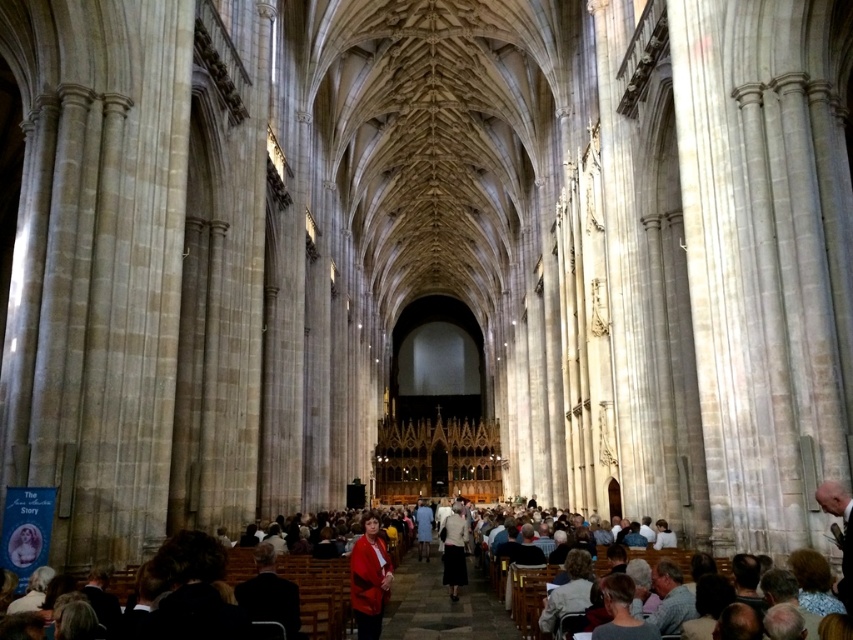
Question: Which of the following is the farthest from the observer?

Choices:
 (A) red fabric coat at center
 (B) matte red coat at center

Answer: (B)

Question: In this image, where is matte red coat at center located relative to light beige skirt at center?

Choices:
 (A) below
 (B) above

Answer: (B)

Question: Does matte red coat at center appear over light beige skirt at center?

Choices:
 (A) no
 (B) yes

Answer: (B)

Question: Estimate the real-world distances between objects in this image. Which object is farther from the light beige skirt at center?

Choices:
 (A) red fabric coat at center
 (B) matte red coat at center

Answer: (B)

Question: Which point appears farthest from the camera in this image?

Choices:
 (A) (372, 628)
 (B) (460, 564)

Answer: (B)

Question: Can you confirm if red fabric coat at center is smaller than light beige skirt at center?

Choices:
 (A) no
 (B) yes

Answer: (A)